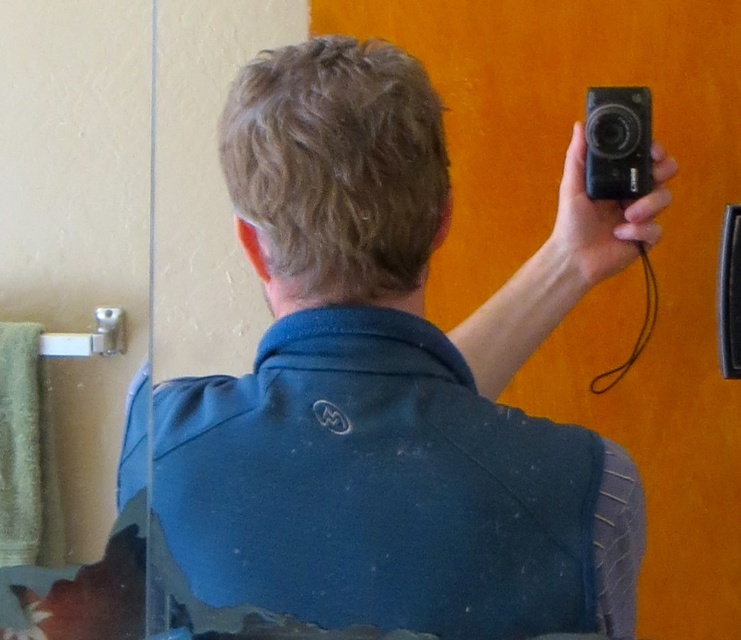
Question: Is blue fabric shirt at upper center smaller than black plastic camera at upper right?

Choices:
 (A) no
 (B) yes

Answer: (A)

Question: Can you confirm if blue fabric shirt at upper center is positioned to the right of black plastic camera at upper right?

Choices:
 (A) no
 (B) yes

Answer: (A)

Question: Is blue fabric shirt at upper center positioned behind black plastic camera at upper right?

Choices:
 (A) yes
 (B) no

Answer: (B)